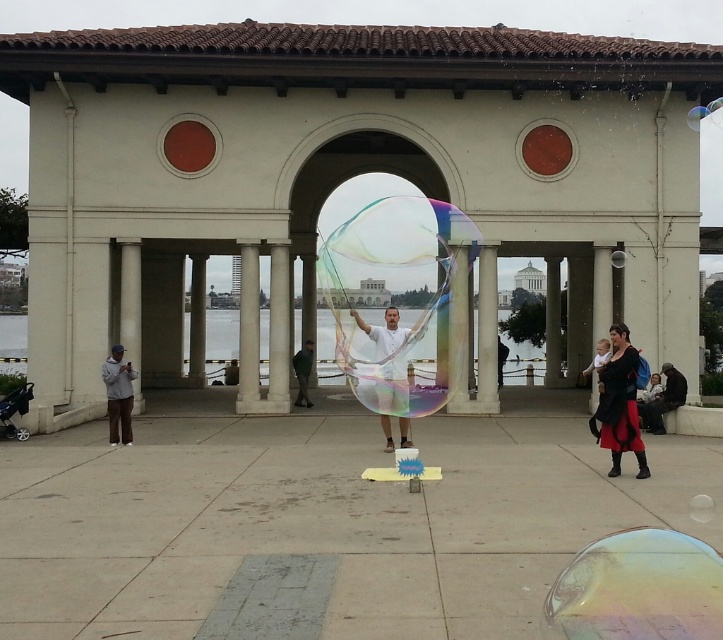
You are a photographer trying to capture the vibrant soap bubbles in the scene. You notice two items in the foreground that might interfere with your shot. These items are the green fabric pants at center and the dark gray fabric at center. Which of these two items is positioned closer to the left side of your frame?

The green fabric pants at center is to the left of the dark gray fabric at center, so it is positioned closer to the left side of the frame.

You are a photographer trying to capture the soap bubbles in the scene. You notice two fabrics in the foreground, the green fabric pants at center and the dark gray fabric at center. Which fabric is closer to you, the photographer, so you can focus on it first?

The green fabric pants at center is closer to you than the dark gray fabric at center, so you should focus on the green fabric pants at center first.

You are standing in front of the classical building and see the transparent iridescent bubble at center. If you want to reach the bubble, which direction should you move relative to your current position?

The transparent iridescent bubble at center is located at point coordinates, so you should move towards the center of the scene to reach it.